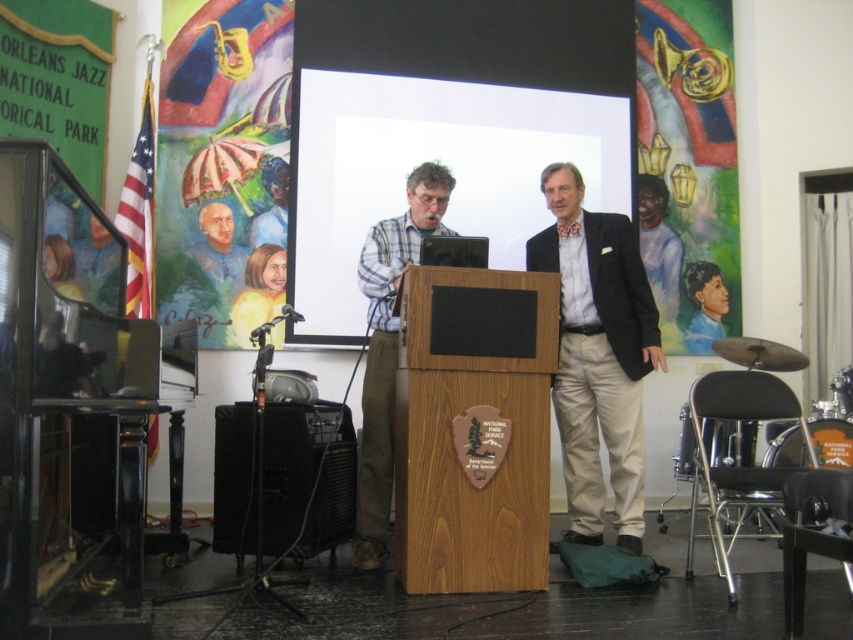
Question: Which of these objects is positioned closest to the white matte projection screen at center?

Choices:
 (A) black plastic speaker at lower left
 (B) dark blue shirt at center

Answer: (B)

Question: Estimate the real-world distances between objects in this image. Which object is farther from the matte black projector at center?

Choices:
 (A) dark blue shirt at center
 (B) white matte projection screen at center
 (C) wooden podium at center

Answer: (A)

Question: Does white matte projection screen at center appear on the right side of light beige cotton pants at center?

Choices:
 (A) yes
 (B) no

Answer: (B)

Question: Is wooden podium at center positioned at the back of black plastic speaker at lower left?

Choices:
 (A) yes
 (B) no

Answer: (B)

Question: Is wooden podium at center to the left of matte black projector at center from the viewer's perspective?

Choices:
 (A) yes
 (B) no

Answer: (B)

Question: Which point appears closest to the camera in this image?

Choices:
 (A) (659, 198)
 (B) (397, 278)

Answer: (B)